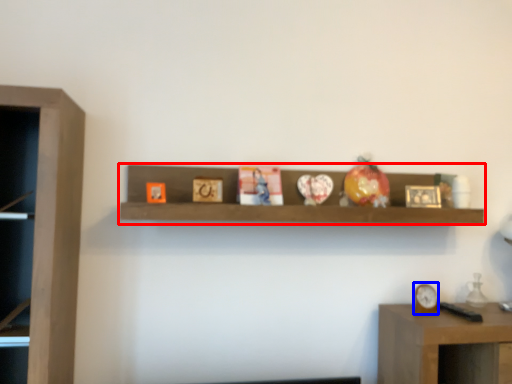
Question: Which object is further to the camera taking this photo, shelf (highlighted by a red box) or clock (highlighted by a blue box)?

Choices:
 (A) shelf
 (B) clock

Answer: (B)